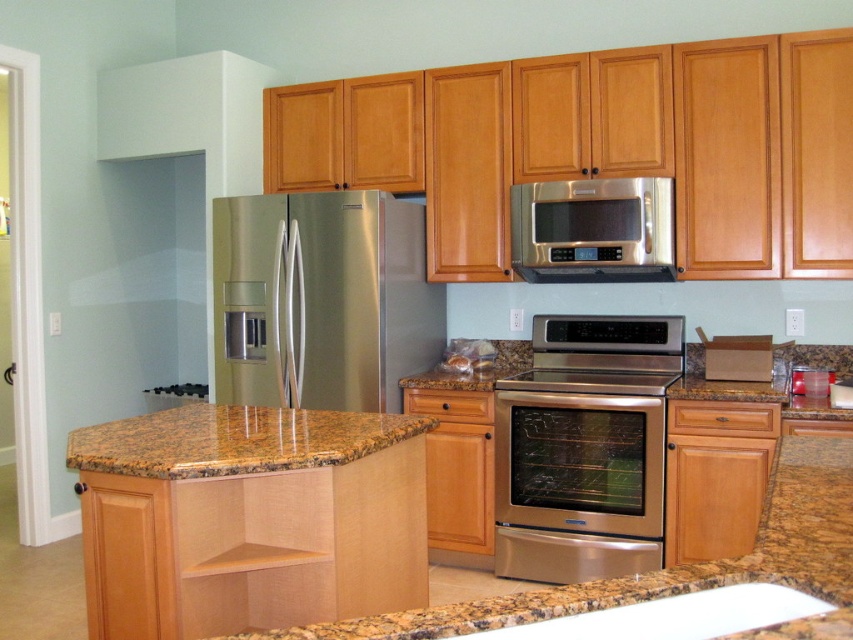
Is stainless steel refrigerator at center above stainless steel microwave at upper center?

No, stainless steel refrigerator at center is not above stainless steel microwave at upper center.

At what (x,y) coordinates should I click in order to perform the action: click on stainless steel refrigerator at center. Please return your answer as a coordinate pair (x, y). The width and height of the screenshot is (853, 640). Looking at the image, I should click on (321, 300).

Who is positioned more to the left, stainless steel refrigerator at center or granite at center?

From the viewer's perspective, granite at center appears more on the left side.

Is stainless steel refrigerator at center thinner than granite at center?

Incorrect, stainless steel refrigerator at center's width is not less than granite at center's.

Is point (413, 320) closer to camera compared to point (193, 408)?

No, (413, 320) is further to viewer.

Locate an element on the screen. The width and height of the screenshot is (853, 640). stainless steel refrigerator at center is located at coordinates (321, 300).

Consider the image. Can you confirm if stainless steel refrigerator at center is taller than stainless steel oven at center?

No.

Is point (361, 266) positioned before point (618, 378)?

Yes, point (361, 266) is closer to viewer.

Locate an element on the screen. The height and width of the screenshot is (640, 853). stainless steel refrigerator at center is located at coordinates (321, 300).